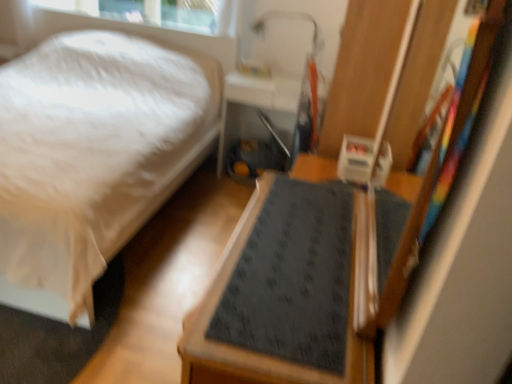
Question: Can you confirm if metallic silver tray at center is smaller than dark gray textured mat at center?

Choices:
 (A) no
 (B) yes

Answer: (B)

Question: Considering the relative positions of metallic silver tray at center and dark gray textured mat at center in the image provided, is metallic silver tray at center to the left of dark gray textured mat at center from the viewer's perspective?

Choices:
 (A) yes
 (B) no

Answer: (A)

Question: Could you tell me if metallic silver tray at center is facing dark gray textured mat at center?

Choices:
 (A) no
 (B) yes

Answer: (B)

Question: Is metallic silver tray at center thinner than dark gray textured mat at center?

Choices:
 (A) yes
 (B) no

Answer: (A)

Question: Are metallic silver tray at center and dark gray textured mat at center beside each other?

Choices:
 (A) no
 (B) yes

Answer: (A)

Question: Is dark gray textured mat at center spatially inside white soft bed at lower left, or outside of it?

Choices:
 (A) inside
 (B) outside

Answer: (B)

Question: In terms of width, does dark gray textured mat at center look wider or thinner when compared to white soft bed at lower left?

Choices:
 (A) wide
 (B) thin

Answer: (B)

Question: Considering the relative positions of dark gray textured mat at center and white soft bed at lower left in the image provided, is dark gray textured mat at center to the left or to the right of white soft bed at lower left?

Choices:
 (A) right
 (B) left

Answer: (A)

Question: From a real-world perspective, is dark gray textured mat at center positioned above or below white soft bed at lower left?

Choices:
 (A) below
 (B) above

Answer: (A)

Question: Looking at their shapes, would you say dark gray textured mat at center is wider or thinner than metallic silver tray at center?

Choices:
 (A) thin
 (B) wide

Answer: (B)

Question: Considering the positions of point (222, 269) and point (240, 92), is point (222, 269) closer or farther from the camera than point (240, 92)?

Choices:
 (A) farther
 (B) closer

Answer: (B)

Question: Choose the correct answer: Is dark gray textured mat at center inside metallic silver tray at center or outside it?

Choices:
 (A) inside
 (B) outside

Answer: (B)

Question: Is dark gray textured mat at center bigger or smaller than metallic silver tray at center?

Choices:
 (A) small
 (B) big

Answer: (B)

Question: Is point (290, 124) closer or farther from the camera than point (101, 198)?

Choices:
 (A) farther
 (B) closer

Answer: (A)

Question: In the image, is metallic silver tray at center positioned in front of or behind white soft bed at lower left?

Choices:
 (A) front
 (B) behind

Answer: (B)